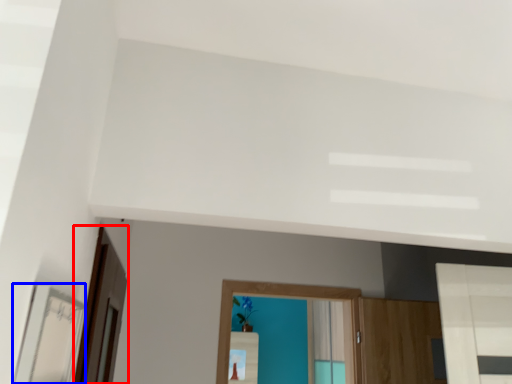
Question: Which object is further to the camera taking this photo, screen door (highlighted by a red box) or mirror (highlighted by a blue box)?

Choices:
 (A) screen door
 (B) mirror

Answer: (A)